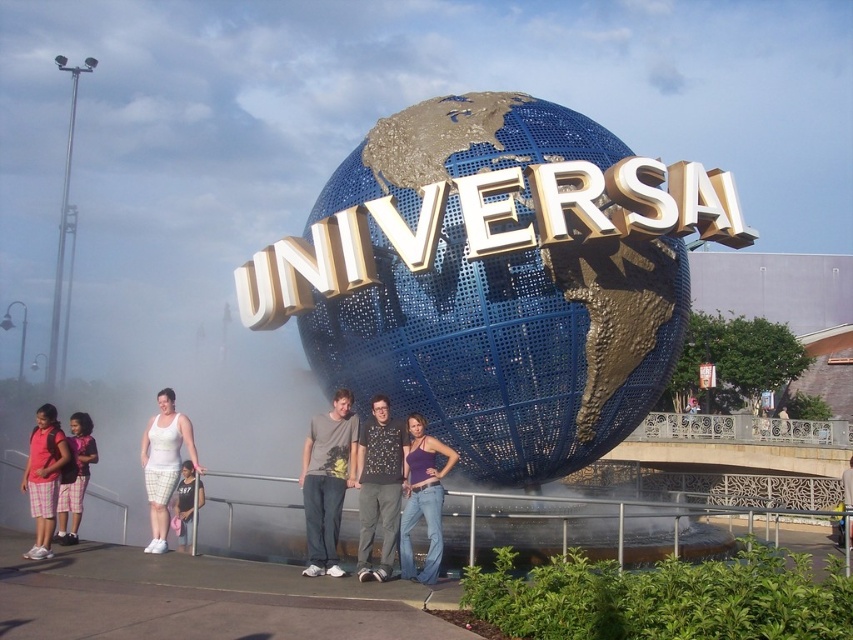
Question: In this image, where is matte gray t-shirt at center located relative to plaid shorts at lower left?

Choices:
 (A) left
 (B) right

Answer: (B)

Question: Which point is closer to the camera?

Choices:
 (A) (38, 460)
 (B) (320, 467)
 (C) (90, 461)

Answer: (B)

Question: Does white mesh shorts at lower left have a lesser width compared to matte white shorts at lower left?

Choices:
 (A) no
 (B) yes

Answer: (A)

Question: Which point is farther to the camera?

Choices:
 (A) (178, 493)
 (B) (73, 540)
 (C) (556, 419)
 (D) (169, 484)

Answer: (A)

Question: Which point is farther to the camera?

Choices:
 (A) (346, 467)
 (B) (364, 442)
 (C) (90, 440)
 (D) (146, 445)

Answer: (C)

Question: Where is matte gray t-shirt at center located in relation to white cotton tank top at lower left in the image?

Choices:
 (A) right
 (B) left

Answer: (A)